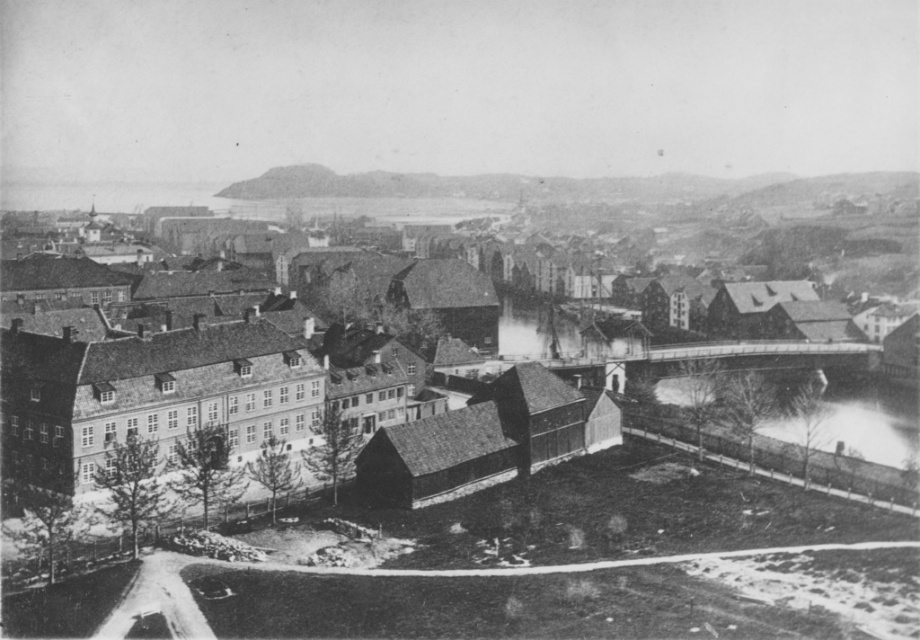
You are standing in the town square of this historical cityscape and notice two points marked on the ground. The first point is at coordinates point (x=569, y=336) and the second is at point (x=831, y=428). If you want to place a small bench between them so that it is closer to the camera, which point should the bench be nearer to?

The bench should be placed closer to point (x=569, y=336) because it is already further to the camera than point (x=831, y=428). Placing it near this point will ensure the bench remains closer to the camera view.

Based on the provided scene description, where is the wooden house at center located in terms of coordinates?

The wooden house at center is located at point (539, 333).

Looking at this image, you are a visitor in this historical town and want to cross to the other side of the white frothy water at lower right. The wooden house at center is in your way. Can you go around it to reach the water?

The wooden house at center is positioned over white frothy water at lower right, so you cannot go around it to reach the water because the house is directly above the water area.